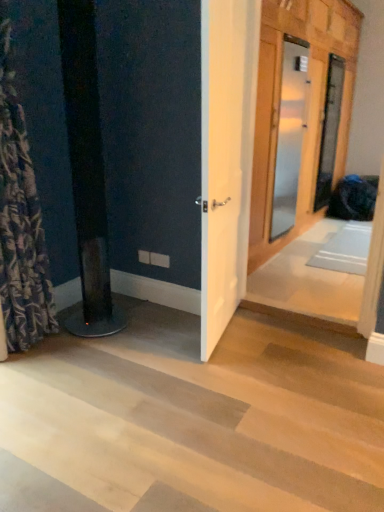
Question: Considering the relative positions of patterned fabric shower curtain at left and wooden door at center, marked as the first door in a right-to-left arrangement, in the image provided, is patterned fabric shower curtain at left to the left of wooden door at center, marked as the first door in a right-to-left arrangement, from the viewer's perspective?

Choices:
 (A) no
 (B) yes

Answer: (B)

Question: Is patterned fabric shower curtain at left wider than wooden door at center, arranged as the 3th door when viewed from the left?

Choices:
 (A) no
 (B) yes

Answer: (B)

Question: Is patterned fabric shower curtain at left at the right side of wooden door at center, arranged as the 3th door when viewed from the left?

Choices:
 (A) no
 (B) yes

Answer: (A)

Question: Can you confirm if patterned fabric shower curtain at left is shorter than wooden door at center, marked as the first door in a right-to-left arrangement?

Choices:
 (A) yes
 (B) no

Answer: (B)

Question: Is patterned fabric shower curtain at left smaller than wooden door at center, marked as the first door in a right-to-left arrangement?

Choices:
 (A) no
 (B) yes

Answer: (A)

Question: Is point (19, 172) positioned closer to the camera than point (342, 64)?

Choices:
 (A) farther
 (B) closer

Answer: (B)

Question: From the image's perspective, is patterned fabric shower curtain at left above or below wooden door at center, arranged as the 3th door when viewed from the left?

Choices:
 (A) above
 (B) below

Answer: (B)

Question: Is patterned fabric shower curtain at left spatially inside wooden door at center, arranged as the 3th door when viewed from the left, or outside of it?

Choices:
 (A) inside
 (B) outside

Answer: (B)

Question: From a real-world perspective, is patterned fabric shower curtain at left physically located above or below wooden door at center, arranged as the 3th door when viewed from the left?

Choices:
 (A) below
 (B) above

Answer: (A)

Question: Is black glossy speaker at left in front of or behind wooden door at center, arranged as the 3th door when viewed from the left, in the image?

Choices:
 (A) front
 (B) behind

Answer: (A)

Question: Is black glossy speaker at left inside the boundaries of wooden door at center, marked as the first door in a right-to-left arrangement, or outside?

Choices:
 (A) outside
 (B) inside

Answer: (A)

Question: Based on their sizes in the image, would you say black glossy speaker at left is bigger or smaller than wooden door at center, marked as the first door in a right-to-left arrangement?

Choices:
 (A) big
 (B) small

Answer: (A)

Question: From a real-world perspective, relative to wooden door at center, arranged as the 3th door when viewed from the left, is black glossy speaker at left vertically above or below?

Choices:
 (A) below
 (B) above

Answer: (A)

Question: Relative to wooden door at center, placed as the third door when sorted from right to left, is patterned fabric shower curtain at left in front or behind?

Choices:
 (A) front
 (B) behind

Answer: (A)

Question: Is patterned fabric shower curtain at left wider or thinner than wooden door at center, placed as the third door when sorted from right to left?

Choices:
 (A) thin
 (B) wide

Answer: (B)